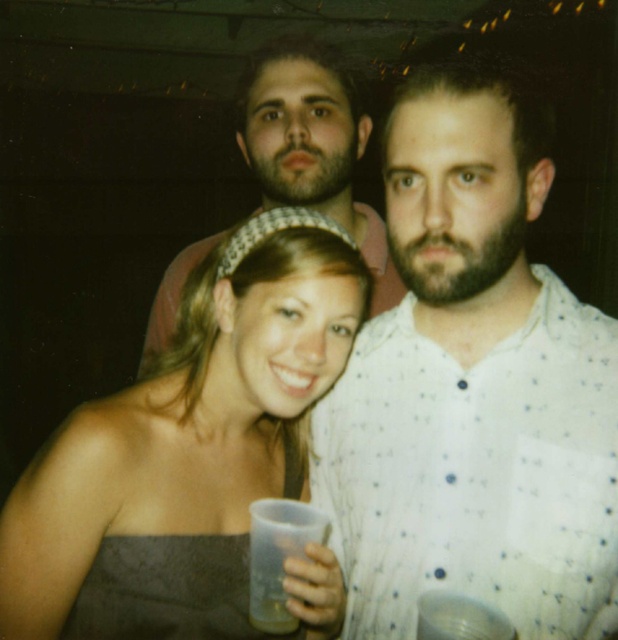
Question: Does white dotted shirt at center have a lesser width compared to matte pink shirt at center?

Choices:
 (A) no
 (B) yes

Answer: (B)

Question: Among these points, which one is farthest from the camera?

Choices:
 (A) (256, 557)
 (B) (286, 157)
 (C) (349, 429)
 (D) (295, 282)

Answer: (B)

Question: Among these objects, which one is nearest to the camera?

Choices:
 (A) translucent plastic cup at center
 (B) matte pink shirt at center
 (C) matte gray dress at center

Answer: (C)

Question: Is matte gray dress at center wider than matte pink shirt at center?

Choices:
 (A) yes
 (B) no

Answer: (B)

Question: Does matte pink shirt at center have a greater width compared to translucent plastic cup at center?

Choices:
 (A) no
 (B) yes

Answer: (B)

Question: Which object appears closest to the camera in this image?

Choices:
 (A) white dotted shirt at center
 (B) matte gray dress at center
 (C) translucent plastic cup at center

Answer: (A)